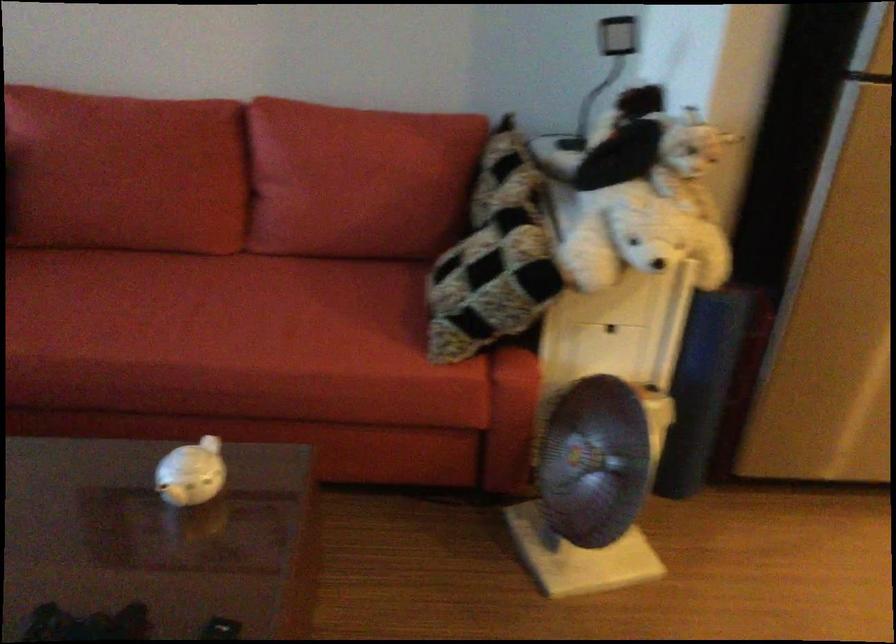
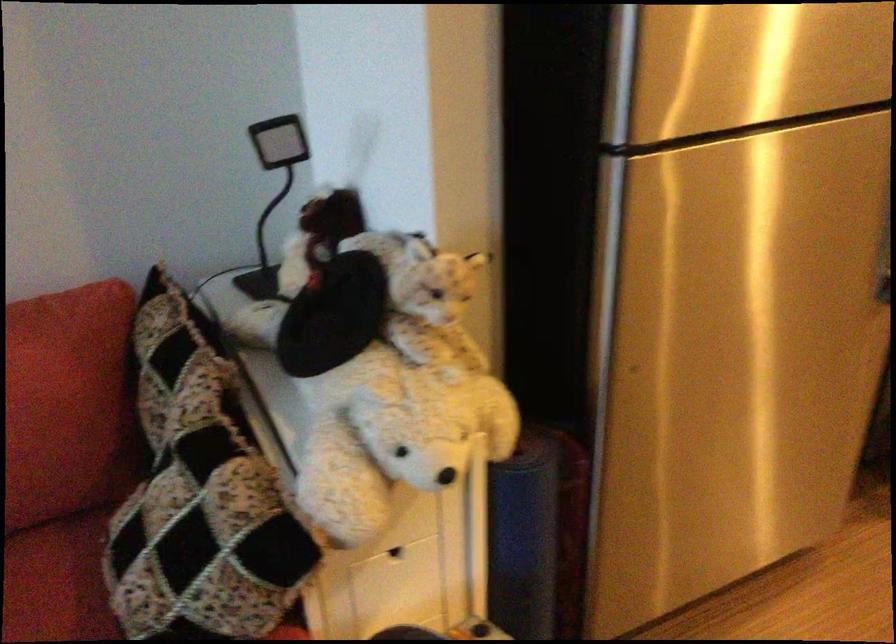
Question: What movement of the cameraman would produce the second image?

Choices:
 (A) Left
 (B) Right
 (C) Forward
 (D) Backward

Answer: (C)